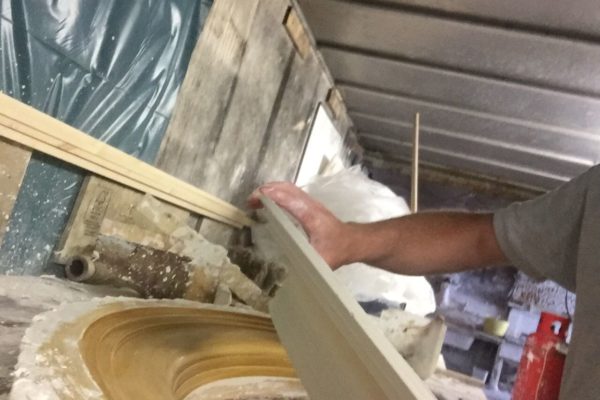
Locate an element on the screen. The width and height of the screenshot is (600, 400). back wall is located at coordinates (491, 286).